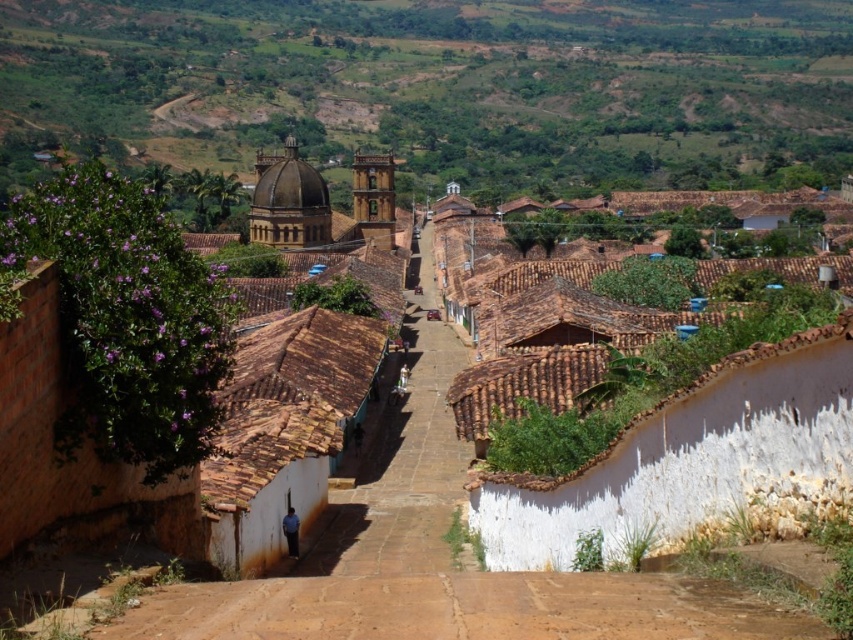
You are standing at the point marked as point (x=444, y=88) on a map of this historic town. What terrain feature are you currently standing on?

You are standing on the green grassy hillside at upper center.

You are a hiker planning to descend from the green grassy hillside at upper center to the brown earthy dirt track at center. Given the steepness of the slope, do you think it would be safe to walk directly down the slope?

The green grassy hillside at upper center is much taller than the brown earthy dirt track at center, indicating a steep slope. This could make the descent risky due to the incline, so it is advisable to look for a less steep path or use proper safety equipment.

You are a tourist in this historic town and want to take a photo that includes both the green grassy hillside at upper center and the brown tiled path at center. Which of these two objects should you focus on to ensure both are clearly visible in your shot?

You should focus on the brown tiled path at center because it is smaller than the green grassy hillside at upper center, allowing both to fit within the frame.